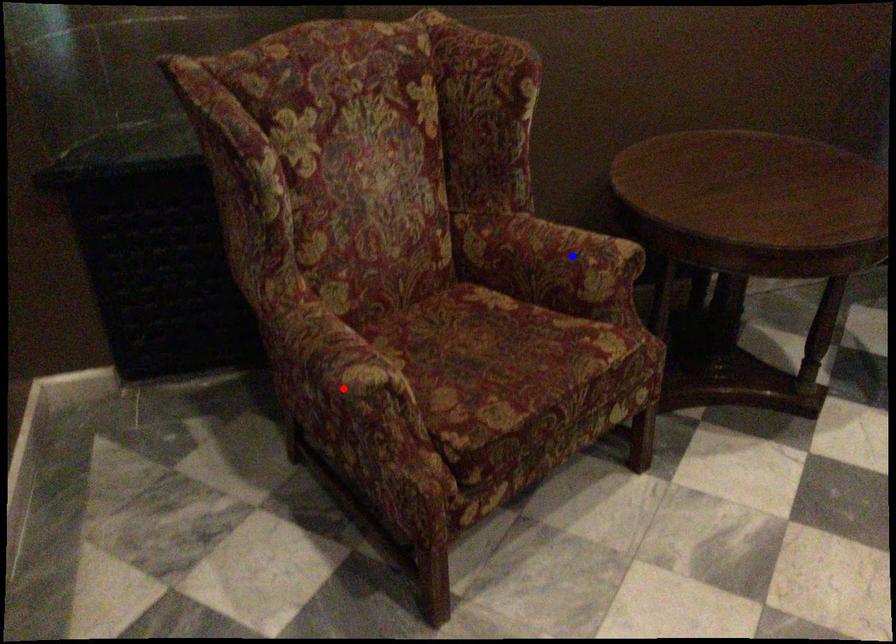
Question: Two points are marked on the image. Which point is closer to the camera?

Choices:
 (A) Blue point is closer.
 (B) Red point is closer.

Answer: (B)